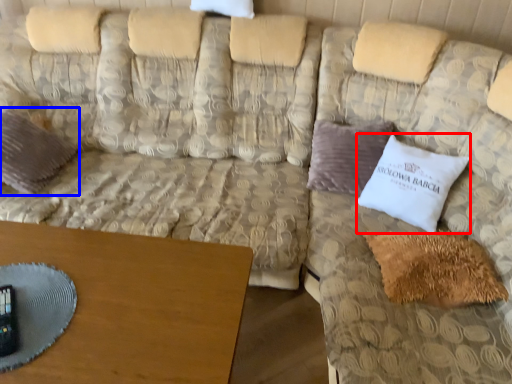
Question: Which object appears farthest to the camera in this image, pillow (highlighted by a red box) or pillow (highlighted by a blue box)?

Choices:
 (A) pillow
 (B) pillow

Answer: (B)